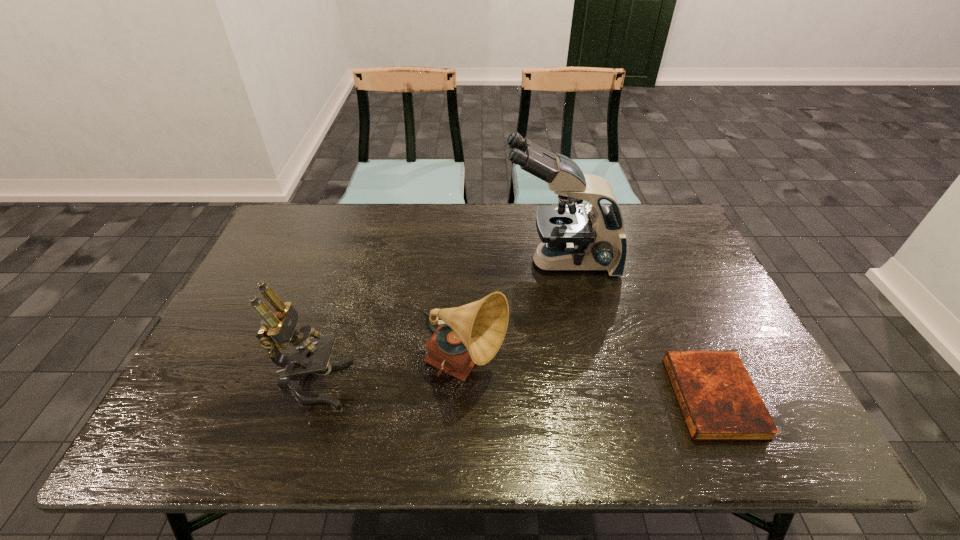
Find the location of a particular element. blank region between the left microscope and the shortest object is located at coordinates (514, 390).

I want to click on free spot between the farthest object and the rightmost object, so click(636, 329).

Locate an element on the screen. This screenshot has width=960, height=540. free space that is in between the phonograph record and the right microscope is located at coordinates (513, 315).

Image resolution: width=960 pixels, height=540 pixels. Find the location of `unoccupied position between the phonograph record and the leftmost object`. unoccupied position between the phonograph record and the leftmost object is located at coordinates (390, 376).

Identify which object is located as the second nearest to the phonograph record. Please provide its 2D coordinates. Your answer should be formatted as a tuple, i.e. [(x, y)], where the tuple contains the x and y coordinates of a point satisfying the conditions above.

[(310, 355)]

Identify the location of object that ranks as the second closest to the second object from right to left. (719, 401).